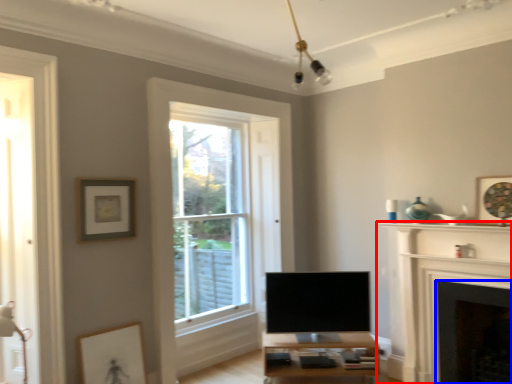
Question: Which of the following is the closest to the observer, fireplace (highlighted by a red box) or fireplace (highlighted by a blue box)?

Choices:
 (A) fireplace
 (B) fireplace

Answer: (A)